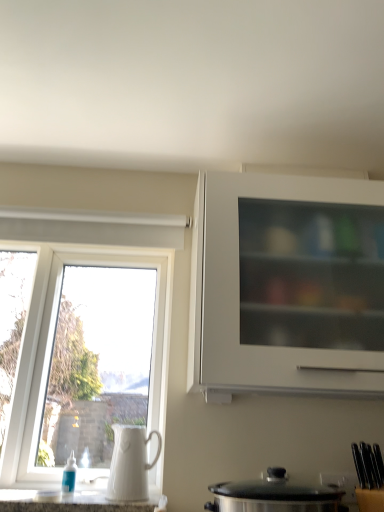
What is the approximate width of white ceramic jug at left?

6.74 inches.

Describe the element at coordinates (130, 463) in the screenshot. The height and width of the screenshot is (512, 384). I see `white ceramic jug at left` at that location.

I want to click on stainless steel pot at lower center, so click(x=274, y=496).

What do you see at coordinates (87, 339) in the screenshot?
I see `white plastic window at left` at bounding box center [87, 339].

Measure the distance between white matte cabinet at upper right and camera.

The distance of white matte cabinet at upper right from camera is 1.21 meters.

Where is `white glossy countertop at lower center`? This screenshot has width=384, height=512. white glossy countertop at lower center is located at coordinates (67, 502).

I want to click on white ceramic jug at left, so click(x=130, y=463).

Is point (266, 325) closer or farther from the camera than point (123, 447)?

Point (266, 325).

From the image's perspective, between white matte cabinet at upper right and white ceramic jug at left, which one is located above?

white matte cabinet at upper right is shown above in the image.

Can we say white matte cabinet at upper right lies outside white ceramic jug at left?

Yes, white matte cabinet at upper right is not within white ceramic jug at left.

Which object is positioned more to the left, stainless steel pot at lower center or white plastic window at left?

white plastic window at left.

Can you see stainless steel pot at lower center touching white plastic window at left?

stainless steel pot at lower center is not next to white plastic window at left, and they're not touching.

From a real-world perspective, is stainless steel pot at lower center on top of white plastic window at left?

No, from a real-world perspective, stainless steel pot at lower center is not above white plastic window at left.

Is stainless steel pot at lower center situated inside white plastic window at left or outside?

stainless steel pot at lower center lies outside white plastic window at left.

How much distance is there between stainless steel pot at lower center and white glossy countertop at lower center?

The distance of stainless steel pot at lower center from white glossy countertop at lower center is 16.64 inches.

Is stainless steel pot at lower center in front of or behind white glossy countertop at lower center in the image?

Visually, stainless steel pot at lower center is located in front of white glossy countertop at lower center.

How different are the orientations of stainless steel pot at lower center and white glossy countertop at lower center in degrees?

0.723 degrees.

Is white glossy countertop at lower center a part of stainless steel pot at lower center?

No, white glossy countertop at lower center is not inside stainless steel pot at lower center.

Between point (119, 433) and point (312, 320), which one is positioned in front?

The point (312, 320) is more forward.

Which of these two, white ceramic jug at left or white matte cabinet at upper right, is smaller?

With smaller size is white ceramic jug at left.

Where is `cabinetry positioned vertically above the white ceramic jug at left (from a real-world perspective)`? cabinetry positioned vertically above the white ceramic jug at left (from a real-world perspective) is located at coordinates (287, 285).

From a real-world perspective, does white ceramic jug at left stand above white matte cabinet at upper right?

No, from a real-world perspective, white ceramic jug at left is not over white matte cabinet at upper right

Considering the relative positions of white matte cabinet at upper right and white plastic window at left in the image provided, is white matte cabinet at upper right in front of white plastic window at left?

That is True.

From a real-world perspective, is white matte cabinet at upper right above or below white plastic window at left?

In terms of real-world spatial position, white matte cabinet at upper right is above white plastic window at left.

How much distance is there between white matte cabinet at upper right and white plastic window at left?

They are 22.04 inches apart.

Looking at this image, is the surface of white matte cabinet at upper right in direct contact with white plastic window at left?

No, white matte cabinet at upper right is not beside white plastic window at left.

Between white plastic window at left and white ceramic jug at left, which one has larger width?

white ceramic jug at left.

Is white plastic window at left bigger than white ceramic jug at left?

Indeed, white plastic window at left has a larger size compared to white ceramic jug at left.

The image size is (384, 512). What are the coordinates of `window on the left of the white ceramic jug at left` in the screenshot? It's located at (87, 339).

Which point is more distant from viewer, (46, 453) or (146, 470)?

The point (46, 453) is more distant.

Identify the location of cabinetry that appears above the stainless steel pot at lower center (from the image's perspective). (287, 285).

Which object is wider, stainless steel pot at lower center or white matte cabinet at upper right?

white matte cabinet at upper right is wider.

Is white matte cabinet at upper right inside stainless steel pot at lower center?

No.

Between point (286, 488) and point (298, 180), which one is positioned behind?

The point (298, 180) is behind.

I want to click on cabinetry on the right of white ceramic jug at left, so click(x=287, y=285).

Find the location of a particular element. The height and width of the screenshot is (512, 384). kitchen appliance in front of the white plastic window at left is located at coordinates (274, 496).

When comparing their distances from white matte cabinet at upper right, does stainless steel pot at lower center or white glossy countertop at lower center seem closer?

Based on the image, stainless steel pot at lower center appears to be nearer to white matte cabinet at upper right.

In the scene shown: From the image, which object appears to be farther from white matte cabinet at upper right, white plastic window at left or white glossy countertop at lower center?

Based on the image, white glossy countertop at lower center appears to be further to white matte cabinet at upper right.

From the image, which object appears to be nearer to white matte cabinet at upper right, white plastic window at left or white ceramic jug at left?

white plastic window at left lies closer to white matte cabinet at upper right than the other object.

Looking at this image, considering their positions, is white matte cabinet at upper right positioned further to white ceramic jug at left than stainless steel pot at lower center?

Among the two, white matte cabinet at upper right is located further to white ceramic jug at left.

Looking at the image, which one is located further to white plastic window at left, white glossy countertop at lower center or white matte cabinet at upper right?

The object further to white plastic window at left is white matte cabinet at upper right.

When comparing their distances from white matte cabinet at upper right, does stainless steel pot at lower center or white plastic window at left seem closer?

Among the two, stainless steel pot at lower center is located nearer to white matte cabinet at upper right.

Based on their spatial positions, is stainless steel pot at lower center or white matte cabinet at upper right further from white plastic window at left?

Among the two, stainless steel pot at lower center is located further to white plastic window at left.

From the picture: Looking at the image, which one is located further to white glossy countertop at lower center, white plastic window at left or white ceramic jug at left?

The object further to white glossy countertop at lower center is white plastic window at left.

Identify the location of jug between white glossy countertop at lower center and white matte cabinet at upper right in the horizontal direction. (130, 463).

Where is `jug between white plastic window at left and stainless steel pot at lower center`? This screenshot has width=384, height=512. jug between white plastic window at left and stainless steel pot at lower center is located at coordinates (130, 463).

At what (x,y) coordinates should I click in order to perform the action: click on jug located between white plastic window at left and white matte cabinet at upper right in the left-right direction. Please return your answer as a coordinate pair (x, y). This screenshot has width=384, height=512. Looking at the image, I should click on (130, 463).

Where is `jug between white plastic window at left and white glossy countertop at lower center in the vertical direction`? jug between white plastic window at left and white glossy countertop at lower center in the vertical direction is located at coordinates (130, 463).